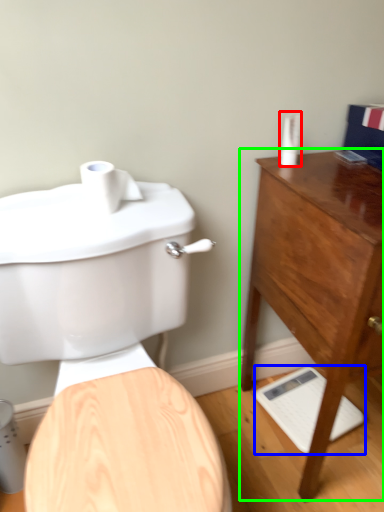
Question: Considering the real-world distances, which object is closest to toiletry (highlighted by a red box)? porcelain (highlighted by a blue box) or chest of drawers (highlighted by a green box).

Choices:
 (A) porcelain
 (B) chest of drawers

Answer: (B)